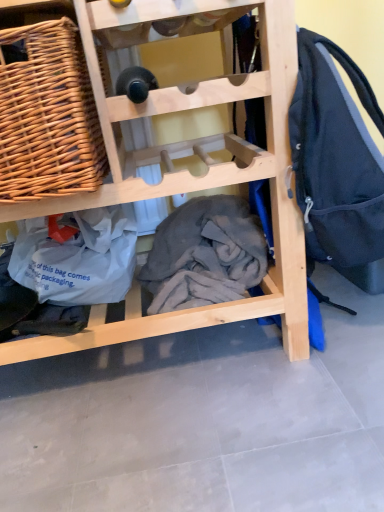
Find the location of a particular element. vacant area in front of natural wood wine rack at center is located at coordinates (171, 452).